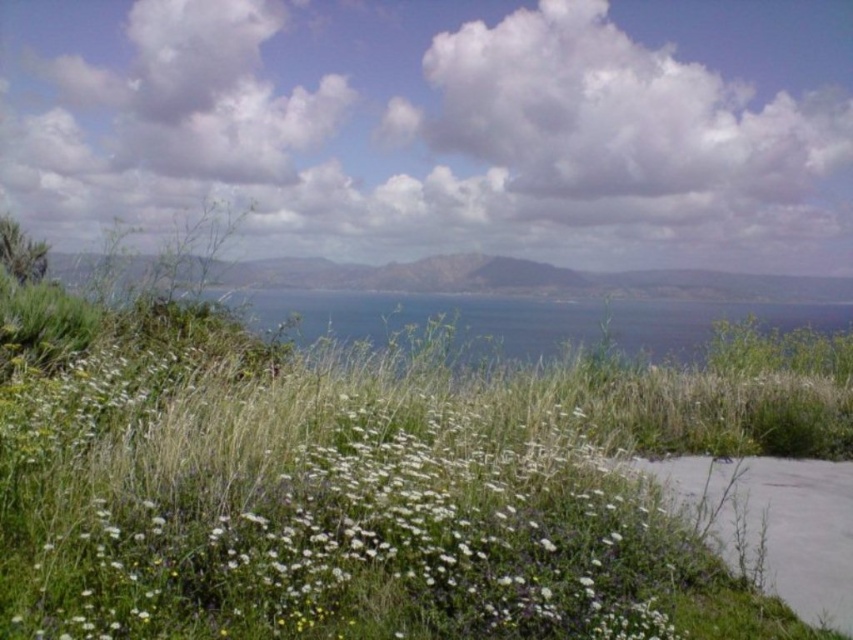
You are an artist trying to paint the scene. You notice the white fluffy cloud at upper center and the white fluffy flowers at center. Which one do you think is wider in the image?

The white fluffy cloud at upper center might be wider than white fluffy flowers at center.

You are standing on the coastal path and want to determine which of the two points, point (293, 595) or point (844, 609), is nearer to you. Based on the scene description, which point is closer?

Point (293, 595) is closer to the viewer than point (844, 609), so it is the nearer one.

You are a gardener planning to plant more white fluffy flowers at center along the gray concrete path at lower right. Considering their widths, which area can accommodate more flowers without overcrowding?

The white fluffy flowers at center have a greater width than the gray concrete path at lower right, so the path cannot accommodate as many flowers. The area around the white fluffy flowers at center would be better suited for planting more flowers without overcrowding.